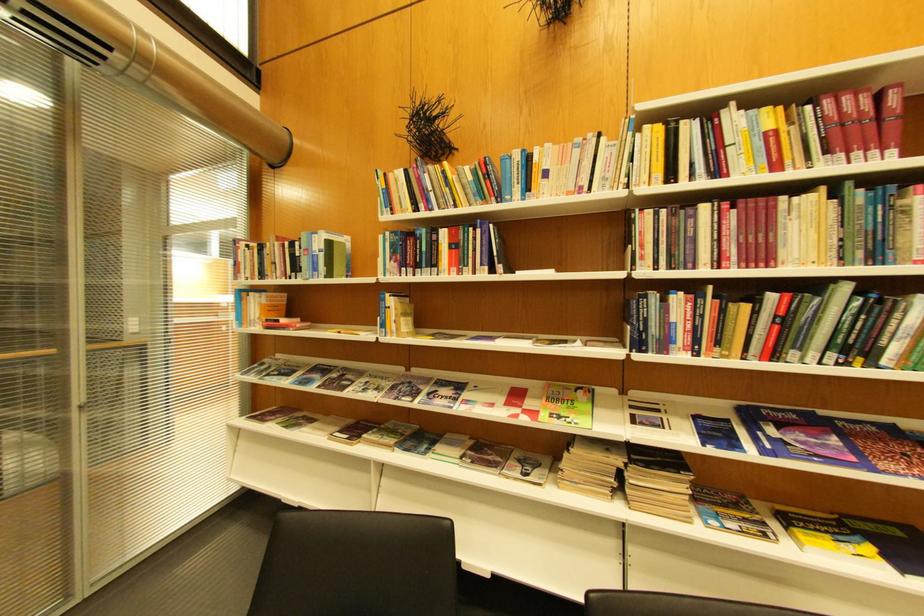
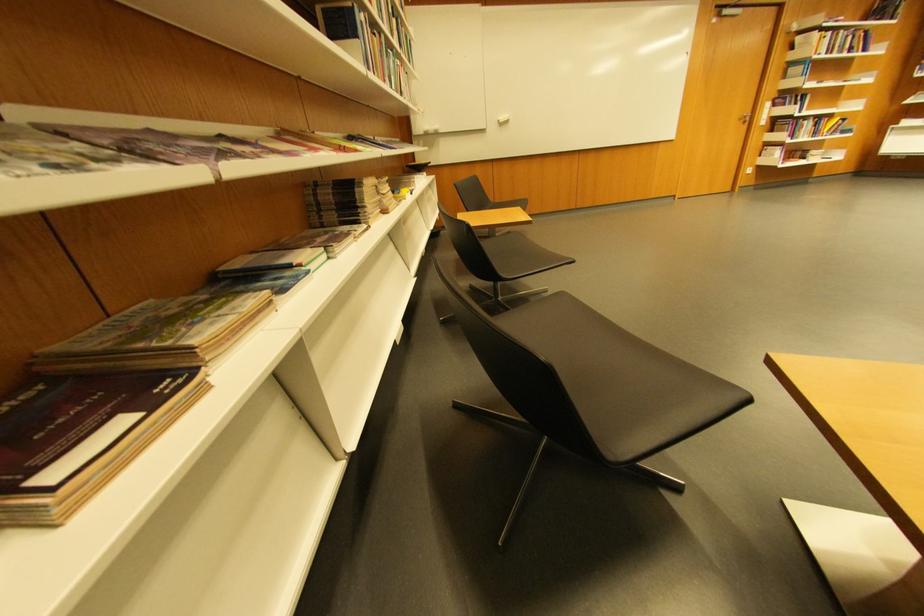
Find the pixel in the second image that matches (x=574, y=472) in the first image.

(379, 207)